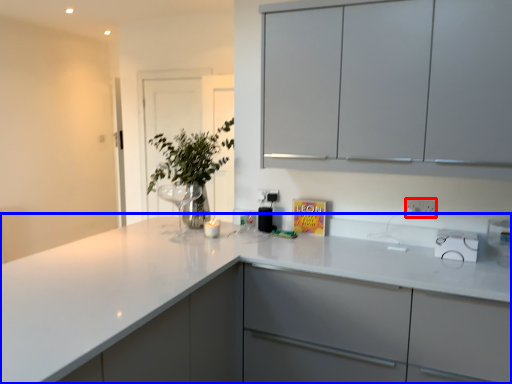
Question: Among these objects, which one is farthest to the camera, electric outlet (highlighted by a red box) or countertop (highlighted by a blue box)?

Choices:
 (A) electric outlet
 (B) countertop

Answer: (A)